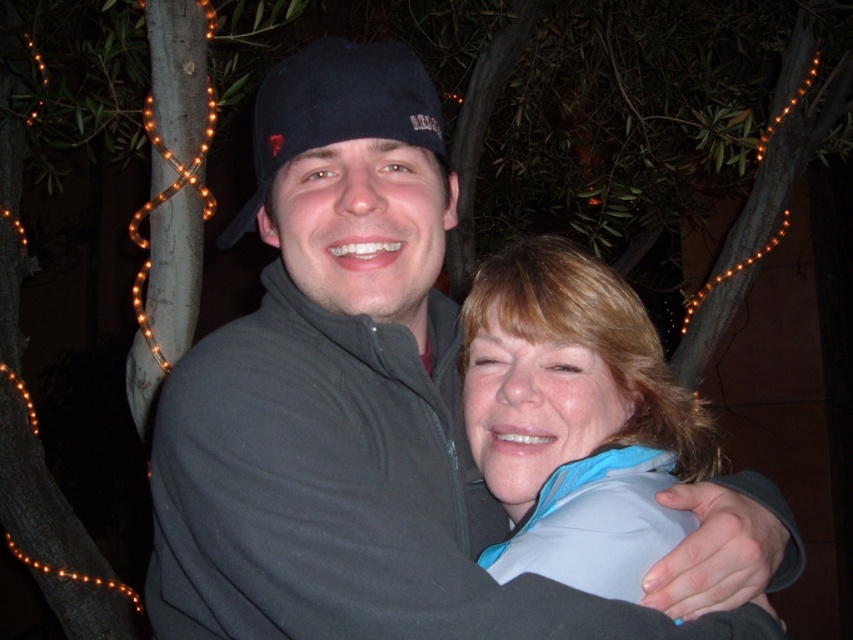
Is dark gray fleece at center above blue fabric at center?

Correct, dark gray fleece at center is located above blue fabric at center.

Which is in front, point (325, 436) or point (579, 333)?

Point (325, 436)

Where is `dark gray fleece at center`? The image size is (853, 640). dark gray fleece at center is located at coordinates (347, 401).